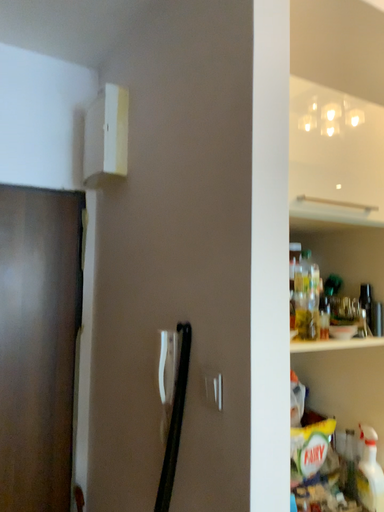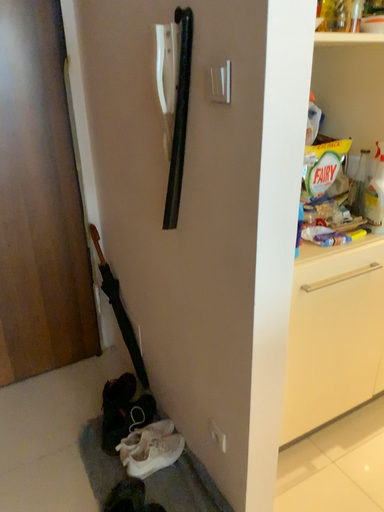
Question: How did the camera likely rotate when shooting the video?

Choices:
 (A) rotated downward
 (B) rotated upward

Answer: (A)